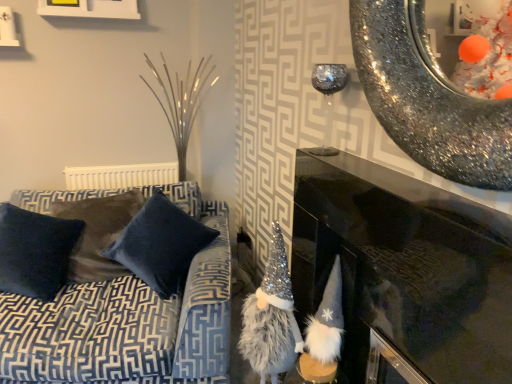
Image resolution: width=512 pixels, height=384 pixels. I want to click on vacant space situated above white matte picture frame at upper left (from a real-world perspective), so click(87, 4).